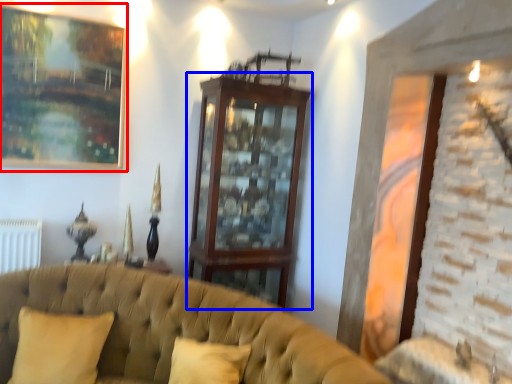
Question: Which object is closer to the camera taking this photo, picture frame (highlighted by a red box) or dresser (highlighted by a blue box)?

Choices:
 (A) picture frame
 (B) dresser

Answer: (A)